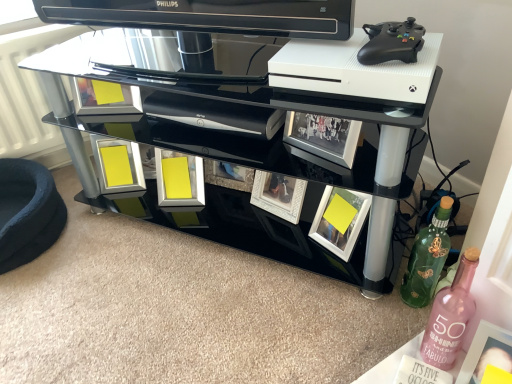
I want to click on vacant area that lies between white glossy magazine at lower right and velvet cushion at lower left, so click(179, 286).